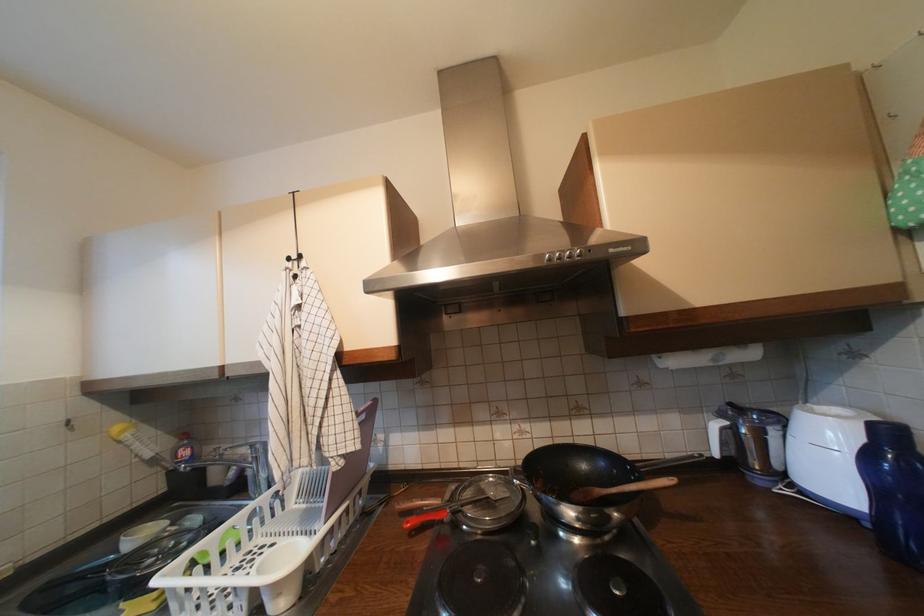
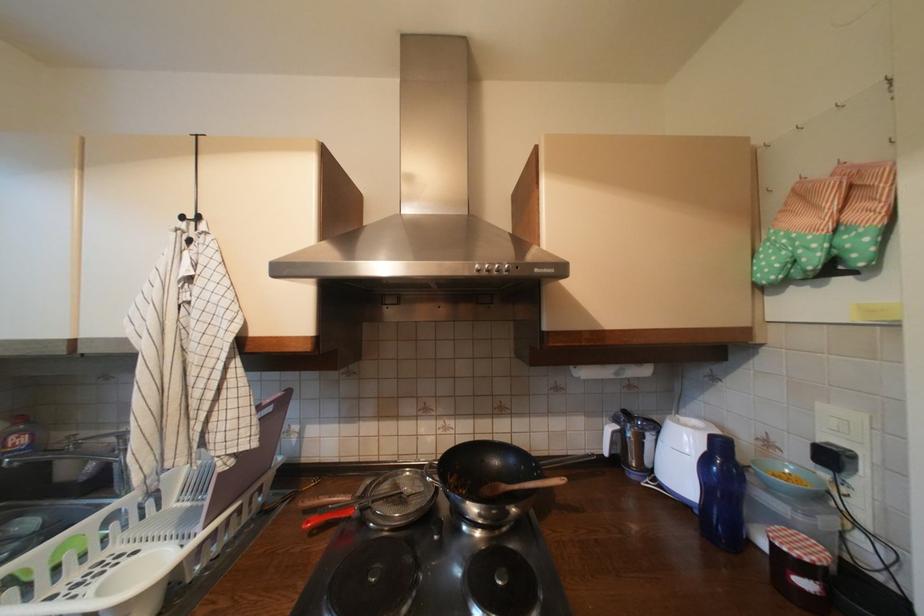
The point at (301, 259) is marked in the first image. Where is the corresponding point in the second image?

(197, 219)